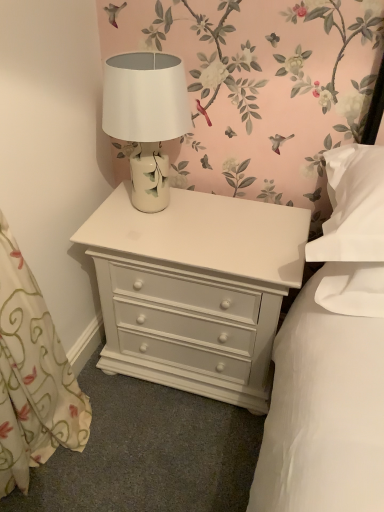
I want to click on vacant region above white painted wood nightstand at center (from a real-world perspective), so (x=210, y=220).